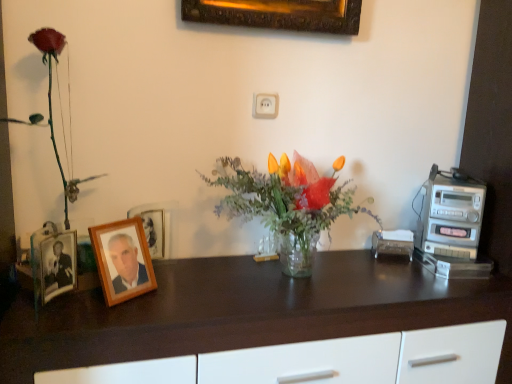
Find the location of a particular element. free spot to the right of clear glass vase at center is located at coordinates (391, 279).